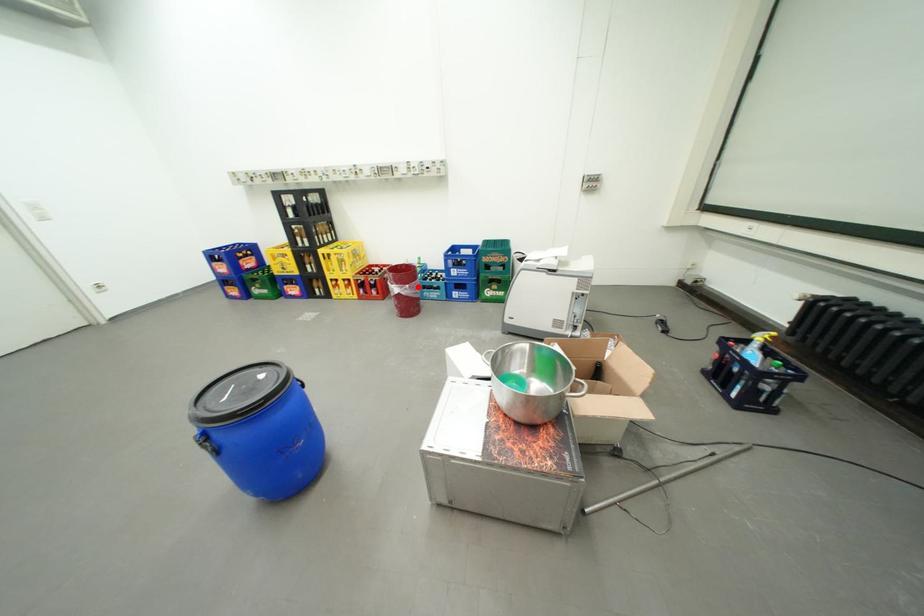
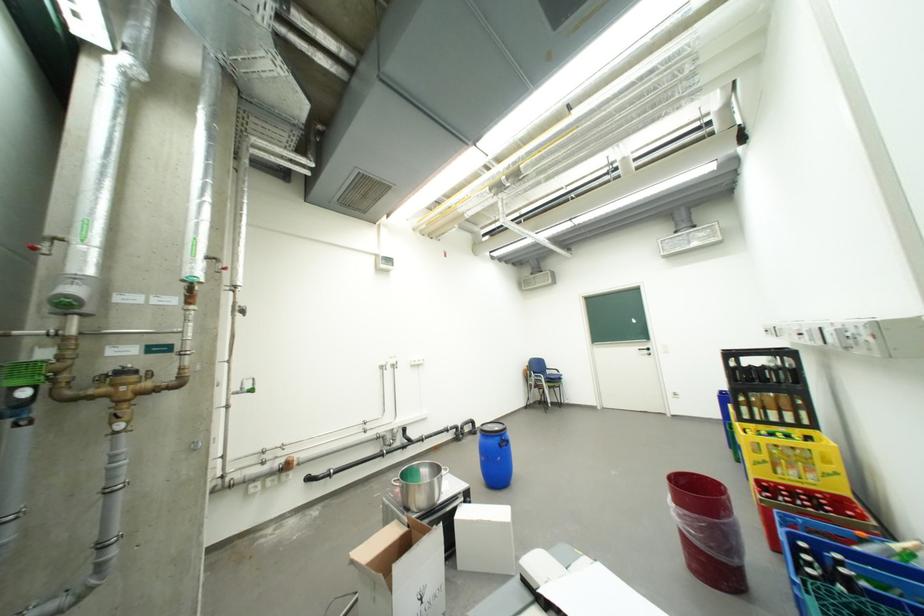
Locate, in the second image, the point that corresponds to the highlighted location in the first image.

(685, 507)